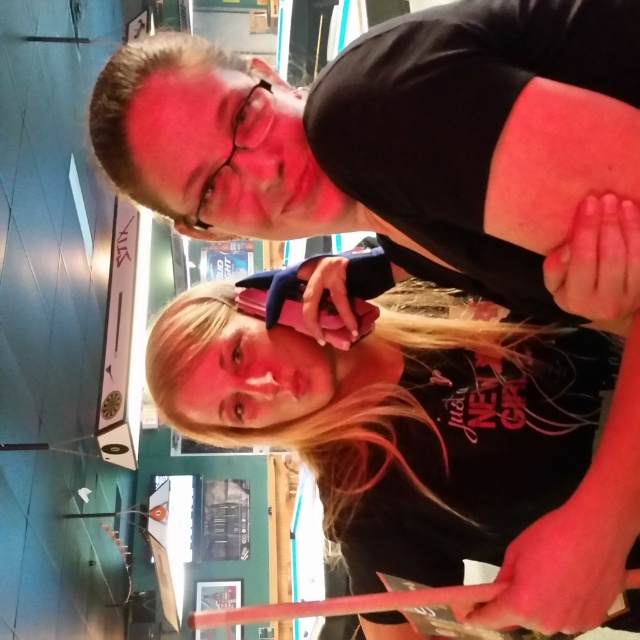
Can you confirm if matte black phone at upper center is shorter than dark brown hair at upper center?

No, matte black phone at upper center is not shorter than dark brown hair at upper center.

Between point (596, 115) and point (140, 83), which one is positioned in front?

Point (596, 115) is more forward.

Find the location of a particular element. matte black phone at upper center is located at coordinates (404, 145).

Is matte black phone at upper center above black matte phone at center?

Indeed, matte black phone at upper center is positioned over black matte phone at center.

Is matte black phone at upper center thinner than black matte phone at center?

Yes, matte black phone at upper center is thinner than black matte phone at center.

Between point (529, 296) and point (152, 388), which one is positioned in front?

Positioned in front is point (529, 296).

Locate an element on the screen. matte black phone at upper center is located at coordinates (404, 145).

Between point (592, 620) and point (176, 218), which one is positioned in front?

Point (592, 620) is in front.

Is black matte phone at center closer to the viewer compared to dark brown hair at upper center?

That is True.

Which is in front, point (216, 285) or point (134, 170)?

Point (134, 170)

At what (x,y) coordinates should I click in order to perform the action: click on black matte phone at center. Please return your answer as a coordinate pair (x, y). The width and height of the screenshot is (640, 640). Looking at the image, I should click on (428, 442).